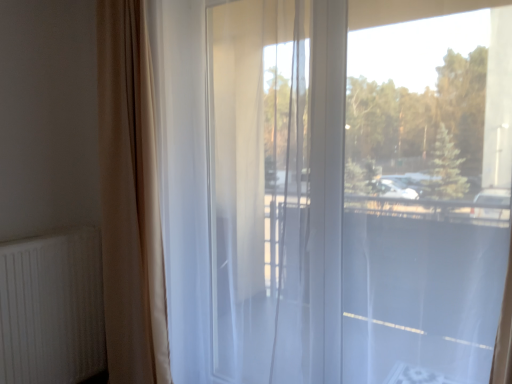
Question: Does white ribbed radiator at lower left have a smaller size compared to beige fabric curtain at left?

Choices:
 (A) yes
 (B) no

Answer: (A)

Question: Can you confirm if white ribbed radiator at lower left is positioned to the right of beige fabric curtain at left?

Choices:
 (A) no
 (B) yes

Answer: (A)

Question: Considering the relative sizes of white ribbed radiator at lower left and beige fabric curtain at left in the image provided, is white ribbed radiator at lower left bigger than beige fabric curtain at left?

Choices:
 (A) yes
 (B) no

Answer: (B)

Question: Does white ribbed radiator at lower left lie behind beige fabric curtain at left?

Choices:
 (A) no
 (B) yes

Answer: (B)

Question: Are white ribbed radiator at lower left and beige fabric curtain at left far apart?

Choices:
 (A) yes
 (B) no

Answer: (B)

Question: Considering the positions of beige fabric curtain at left and white ribbed radiator at lower left in the image, is beige fabric curtain at left wider or thinner than white ribbed radiator at lower left?

Choices:
 (A) thin
 (B) wide

Answer: (B)

Question: In the image, is beige fabric curtain at left on the left side or the right side of white ribbed radiator at lower left?

Choices:
 (A) left
 (B) right

Answer: (B)

Question: Considering the positions of beige fabric curtain at left and white ribbed radiator at lower left in the image, is beige fabric curtain at left bigger or smaller than white ribbed radiator at lower left?

Choices:
 (A) big
 (B) small

Answer: (A)

Question: Does point (116, 11) appear closer or farther from the camera than point (31, 380)?

Choices:
 (A) closer
 (B) farther

Answer: (A)

Question: From a real-world perspective, relative to transparent glass window at center, is white ribbed radiator at lower left vertically above or below?

Choices:
 (A) below
 (B) above

Answer: (A)

Question: Is white ribbed radiator at lower left in front of or behind transparent glass window at center in the image?

Choices:
 (A) behind
 (B) front

Answer: (A)

Question: Considering the positions of white ribbed radiator at lower left and transparent glass window at center in the image, is white ribbed radiator at lower left wider or thinner than transparent glass window at center?

Choices:
 (A) wide
 (B) thin

Answer: (B)

Question: Is white ribbed radiator at lower left bigger or smaller than transparent glass window at center?

Choices:
 (A) big
 (B) small

Answer: (B)

Question: From the image's perspective, is transparent glass window at center positioned above or below beige fabric curtain at left?

Choices:
 (A) above
 (B) below

Answer: (A)

Question: Is transparent glass window at center inside the boundaries of beige fabric curtain at left, or outside?

Choices:
 (A) outside
 (B) inside

Answer: (A)